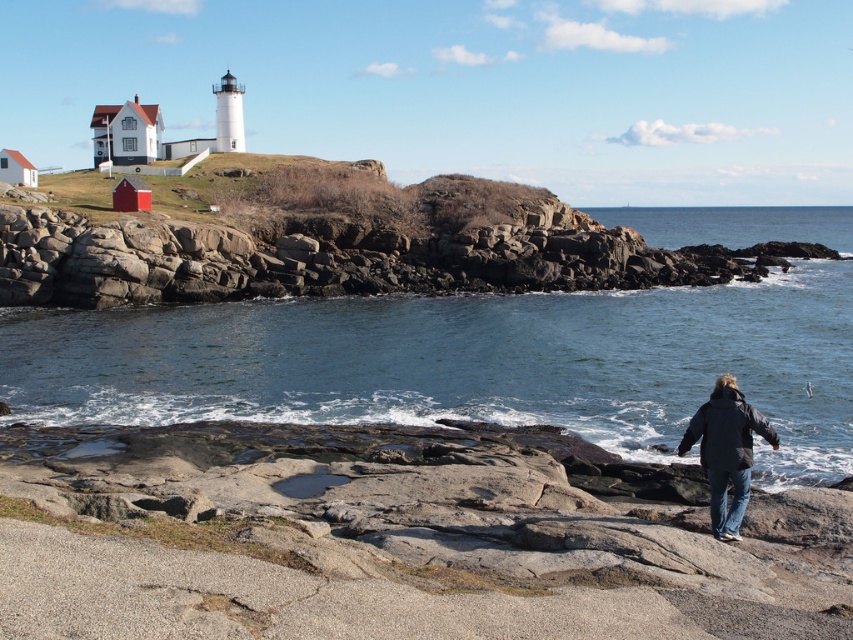
Question: Which object is closer to the camera taking this photo?

Choices:
 (A) rocky at upper left
 (B) dark blue jacket at lower right
 (C) clear blue water at center

Answer: (B)

Question: Is clear blue water at center to the left of dark blue jacket at lower right from the viewer's perspective?

Choices:
 (A) no
 (B) yes

Answer: (A)

Question: Does clear blue water at center have a larger size compared to dark blue jacket at lower right?

Choices:
 (A) no
 (B) yes

Answer: (B)

Question: Which of the following is the closest to the observer?

Choices:
 (A) (524, 268)
 (B) (752, 428)

Answer: (B)

Question: Can you confirm if clear blue water at center is bigger than rocky at upper left?

Choices:
 (A) no
 (B) yes

Answer: (B)

Question: Which point is closer to the camera taking this photo?

Choices:
 (A) (643, 282)
 (B) (177, 372)
 (C) (730, 474)

Answer: (C)